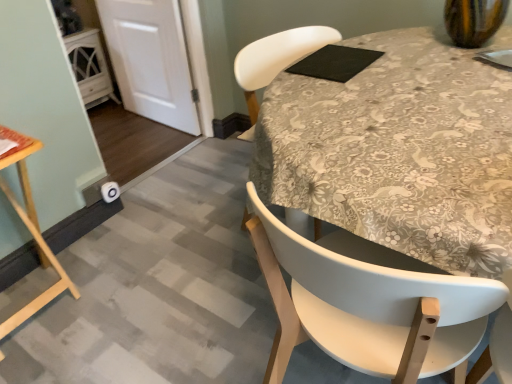
Locate an element on the screen. vacant space to the right of black matte pad at upper center is located at coordinates (386, 54).